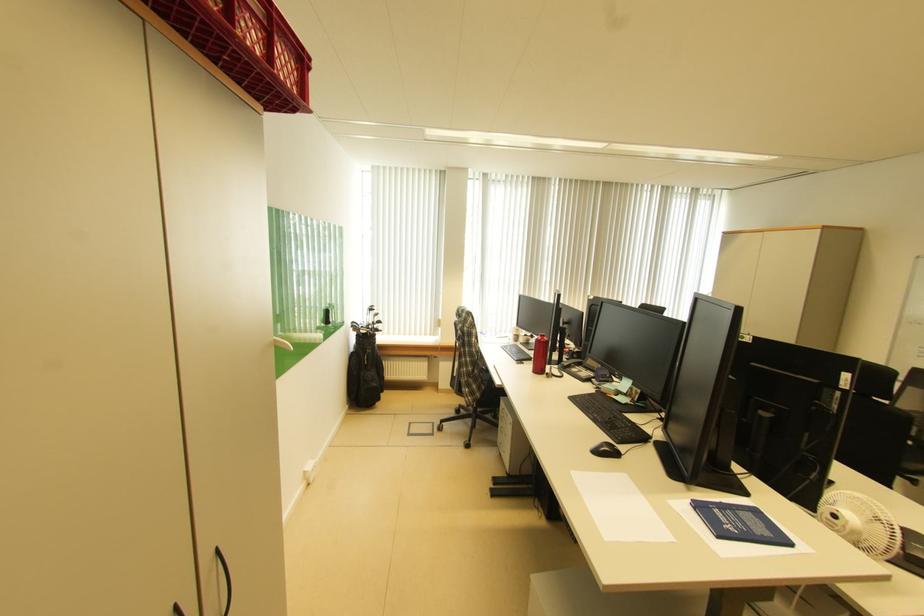
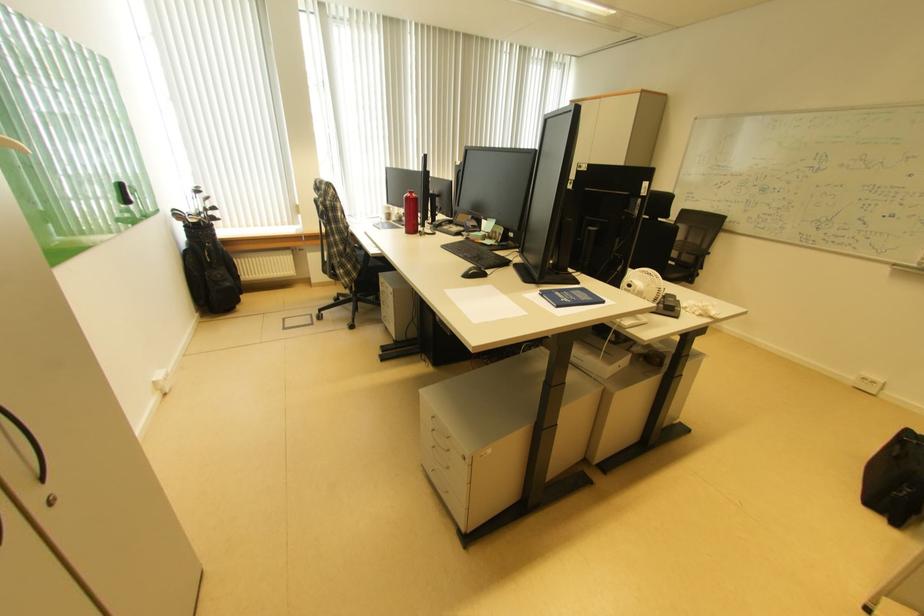
Where in the second image is the point corresponding to pixel 227 562 from the first image?

(6, 415)